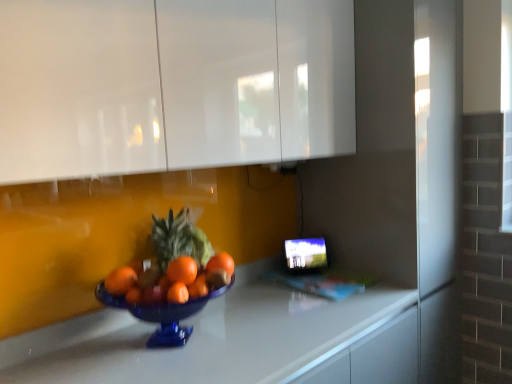
The height and width of the screenshot is (384, 512). What are the coordinates of `white glossy countertop at center` in the screenshot? It's located at (204, 339).

Describe the element at coordinates (204, 339) in the screenshot. This screenshot has height=384, width=512. I see `white glossy countertop at center` at that location.

What do you see at coordinates (170, 84) in the screenshot? The image size is (512, 384). I see `white glossy cabinets at upper center` at bounding box center [170, 84].

Where is `white glossy cabinets at upper center`? white glossy cabinets at upper center is located at coordinates (170, 84).

This screenshot has height=384, width=512. In order to click on white glossy countertop at center in this screenshot , I will do `click(204, 339)`.

Between white glossy countertop at center and white glossy cabinets at upper center, which one appears on the left side from the viewer's perspective?

Positioned to the left is white glossy cabinets at upper center.

From the picture: Is white glossy countertop at center in front of or behind white glossy cabinets at upper center in the image?

In the image, white glossy countertop at center appears in front of white glossy cabinets at upper center.

Which is closer, (x=233, y=293) or (x=53, y=7)?

Point (x=53, y=7)

From the image's perspective, which is above, white glossy countertop at center or white glossy cabinets at upper center?

white glossy cabinets at upper center appears higher in the image.

In the scene shown: From a real-world perspective, which is physically above, white glossy countertop at center or white glossy cabinets at upper center?

white glossy cabinets at upper center, from a real-world perspective.

Looking at their sizes, would you say white glossy countertop at center is wider or thinner than white glossy cabinets at upper center?

In the image, white glossy countertop at center appears to be wider than white glossy cabinets at upper center.

Who is taller, white glossy countertop at center or white glossy cabinets at upper center?

With more height is white glossy cabinets at upper center.

In terms of size, does white glossy countertop at center appear bigger or smaller than white glossy cabinets at upper center?

white glossy countertop at center is bigger than white glossy cabinets at upper center.

Does white glossy countertop at center contain white glossy cabinets at upper center?

No, white glossy countertop at center does not contain white glossy cabinets at upper center.

Consider the image. Is white glossy countertop at center next to white glossy cabinets at upper center and touching it?

white glossy countertop at center is not next to white glossy cabinets at upper center, and they're not touching.

Could you tell me if white glossy countertop at center is turned towards white glossy cabinets at upper center?

No, white glossy countertop at center is not oriented towards white glossy cabinets at upper center.

How many degrees apart are the facing directions of white glossy countertop at center and white glossy cabinets at upper center?

There is a 0.27-degree angle between the facing directions of white glossy countertop at center and white glossy cabinets at upper center.

Measure the distance between white glossy countertop at center and white glossy cabinets at upper center.

26.01 inches.

Where is `cabinetry lying on the left of white glossy countertop at center`? This screenshot has width=512, height=384. cabinetry lying on the left of white glossy countertop at center is located at coordinates (170, 84).

Between white glossy cabinets at upper center and white glossy countertop at center, which one appears on the right side from the viewer's perspective?

From the viewer's perspective, white glossy countertop at center appears more on the right side.

Is white glossy cabinets at upper center positioned in front of white glossy countertop at center?

No, white glossy cabinets at upper center is behind white glossy countertop at center.

Considering the positions of points (173, 136) and (290, 313), is point (173, 136) closer to camera compared to point (290, 313)?

Yes, point (173, 136) is in front of point (290, 313).

From the image's perspective, is white glossy cabinets at upper center positioned above or below white glossy countertop at center?

Based on their image positions, white glossy cabinets at upper center is located above white glossy countertop at center.

From a real-world perspective, is white glossy cabinets at upper center physically located above or below white glossy countertop at center?

white glossy cabinets at upper center is above white glossy countertop at center.

Which of these two, white glossy cabinets at upper center or white glossy countertop at center, is thinner?

Thinner between the two is white glossy cabinets at upper center.

Between white glossy cabinets at upper center and white glossy countertop at center, which one has more height?

With more height is white glossy cabinets at upper center.

Based on their sizes in the image, would you say white glossy cabinets at upper center is bigger or smaller than white glossy countertop at center?

In the image, white glossy cabinets at upper center appears to be smaller than white glossy countertop at center.

Is white glossy cabinets at upper center spatially inside white glossy countertop at center, or outside of it?

white glossy cabinets at upper center lies outside white glossy countertop at center.

Are white glossy cabinets at upper center and white glossy countertop at center beside each other?

No, white glossy cabinets at upper center is not with white glossy countertop at center.

Is white glossy cabinets at upper center facing away from white glossy countertop at center?

white glossy cabinets at upper center is not turned away from white glossy countertop at center.

How many degrees apart are the facing directions of white glossy cabinets at upper center and white glossy countertop at center?

The angular difference between white glossy cabinets at upper center and white glossy countertop at center is 0.27 degrees.

I want to click on cabinetry behind the white glossy countertop at center, so click(170, 84).

Identify the location of countertop that is under the white glossy cabinets at upper center (from a real-world perspective). Image resolution: width=512 pixels, height=384 pixels. (204, 339).

Identify the location of cabinetry on the left of white glossy countertop at center. (170, 84).